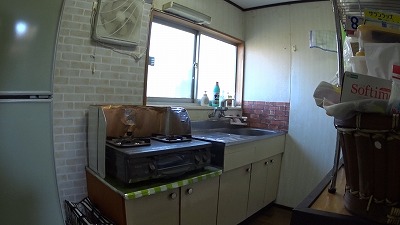
This screenshot has height=225, width=400. In order to click on sink in this screenshot , I will do `click(257, 132)`.